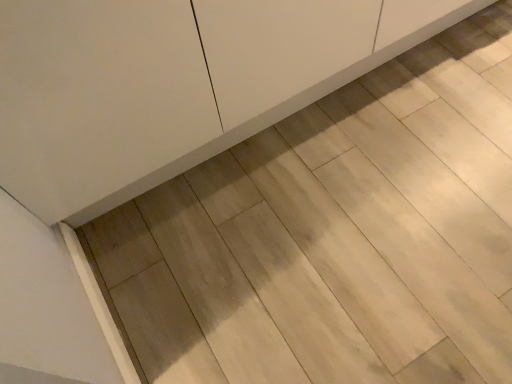
Describe the element at coordinates (148, 93) in the screenshot. I see `white matte cabinet at center` at that location.

Where is `white matte cabinet at center`? white matte cabinet at center is located at coordinates (148, 93).

Image resolution: width=512 pixels, height=384 pixels. In order to click on white matte cabinet at center in this screenshot , I will do `click(148, 93)`.